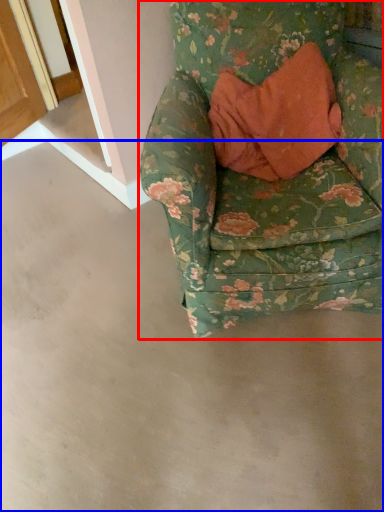
Question: Which point is further to the camera, chair (highlighted by a red box) or concrete (highlighted by a blue box)?

Choices:
 (A) chair
 (B) concrete

Answer: (A)